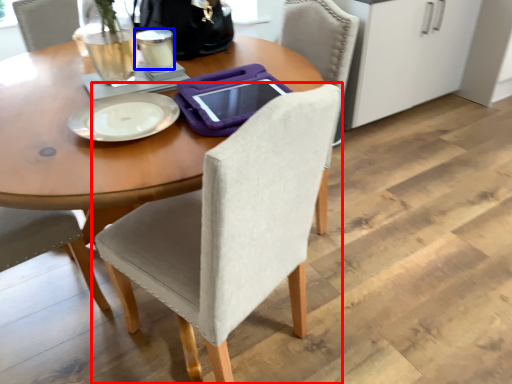
Question: Which object appears closest to the camera in this image, chair (highlighted by a red box) or coffee cup (highlighted by a blue box)?

Choices:
 (A) chair
 (B) coffee cup

Answer: (A)